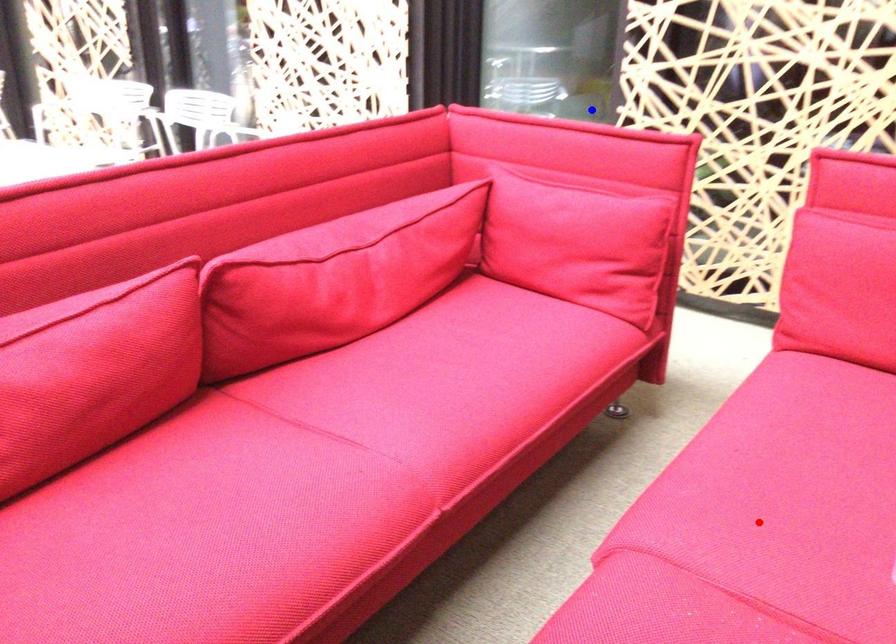
Question: In the image, two points are highlighted. Which point is nearer to the camera? Reply with the corresponding letter.

Choices:
 (A) blue point
 (B) red point

Answer: (B)